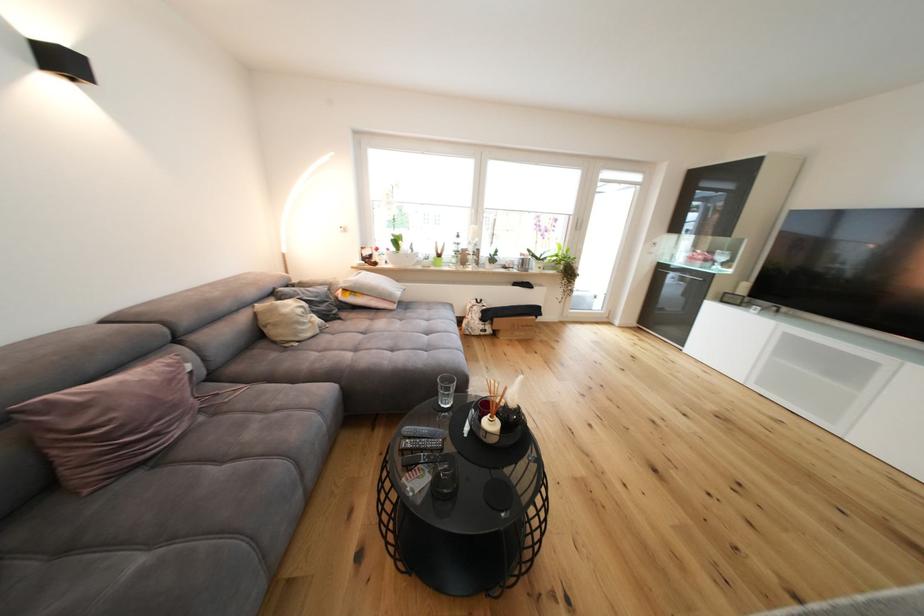
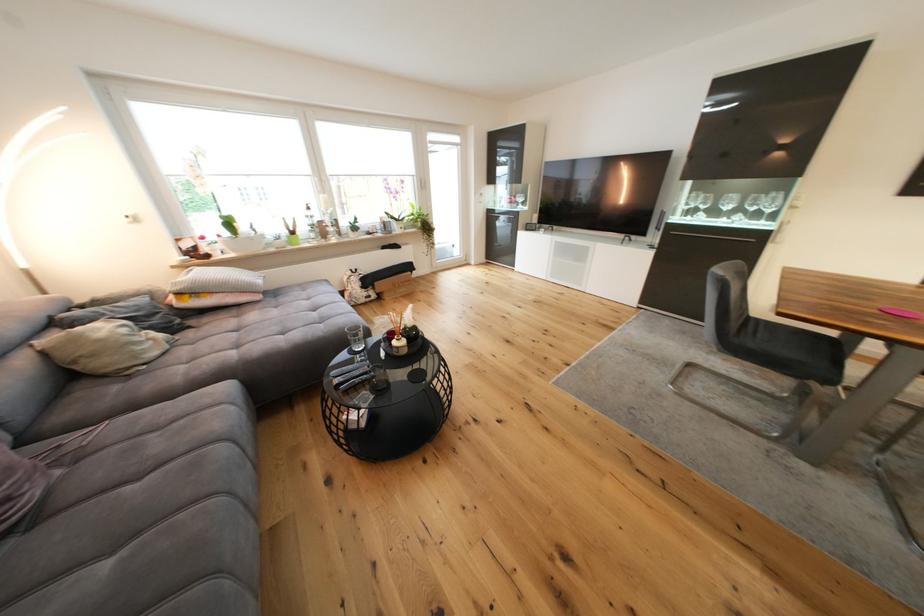
Where in the second image is the point corresponding to (180,408) from the first image?

(18, 469)